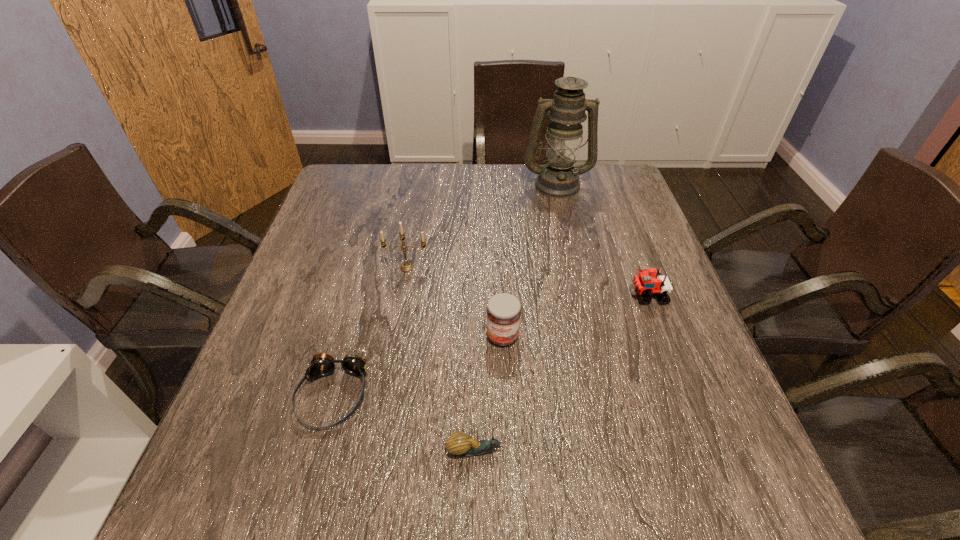
Locate an element on the screen. The width and height of the screenshot is (960, 540). vacant region located on the front of the tallest object is located at coordinates (577, 269).

Identify the location of vacant region located on the front of the candle. (389, 372).

The width and height of the screenshot is (960, 540). In order to click on vacant space situated on the left of the fourth farthest object in this screenshot , I will do `click(401, 336)`.

The width and height of the screenshot is (960, 540). I want to click on free point located on the front-facing side of the third farthest object, so click(588, 295).

Image resolution: width=960 pixels, height=540 pixels. Identify the location of free space located 0.160m on the front-facing side of the third farthest object. (562, 295).

Identify the location of vacant position located 0.250m on the front-facing side of the third farthest object. This screenshot has height=540, width=960. (523, 295).

Where is `vacant space located 0.080m through the lenses of the goggles`? This screenshot has height=540, width=960. vacant space located 0.080m through the lenses of the goggles is located at coordinates (310, 478).

Locate an element on the screen. This screenshot has width=960, height=540. vacant space located 0.210m on the front-facing side of the nearest object is located at coordinates (625, 450).

The image size is (960, 540). Find the location of `object at the far edge`. object at the far edge is located at coordinates (559, 178).

Find the location of a particular element. The height and width of the screenshot is (540, 960). object at the left edge is located at coordinates point(322,365).